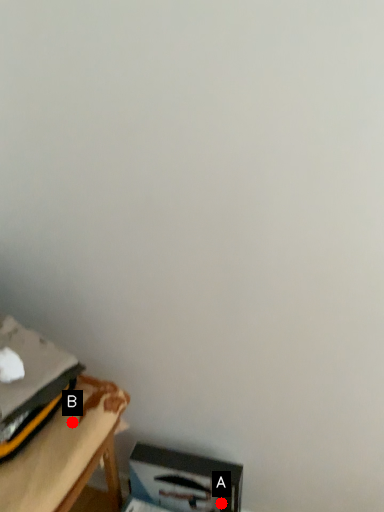
Question: Two points are circled on the image, labeled by A and B beside each circle. Among these points, which one is nearest to the camera?

Choices:
 (A) A is closer
 (B) B is closer

Answer: (B)